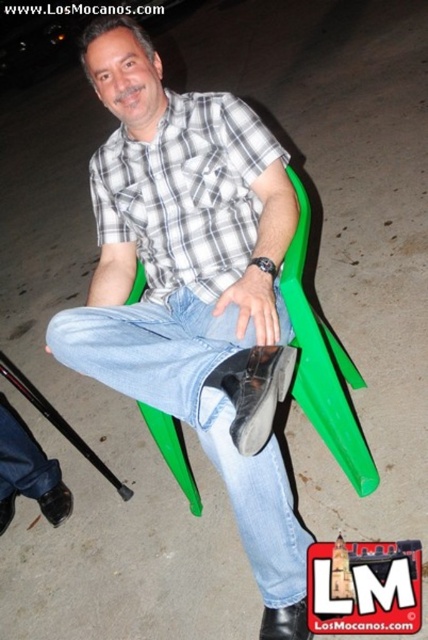
You are a photographer trying to capture both the matte plaid shirt at center and the white checkered shirt at center in a single shot. Based on their positions, which shirt will appear closer to the camera in the photo?

The matte plaid shirt at center will appear closer to the camera because it is positioned in front of the white checkered shirt at center.

You are a fashion designer observing two shirts in the image. The first is a matte plaid shirt at center, and the second is a white checkered shirt at center. Which shirt appears larger in size?

The matte plaid shirt at center is much taller as white checkered shirt at center, so it appears larger in size.

You are organizing a clothing donation drive and need to determine which shirt takes up more space when folded. Based on the image, which of the two shirts at center has a greater width, the matte plaid shirt at center or the white checkered shirt at center?

The matte plaid shirt at center has a greater width than the white checkered shirt at center, so it will take up more space when folded.